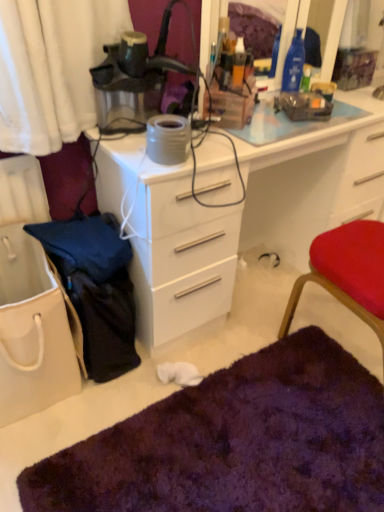
You are a GUI agent. You are given a task and a screenshot of the screen. Output one action in this format:
    pyautogui.click(x=<x>, y=<y>)
    Task: Click on the vacant space in front of matte gray coffee cup at upper right
    
    Given the screenshot: What is the action you would take?
    pyautogui.click(x=341, y=115)